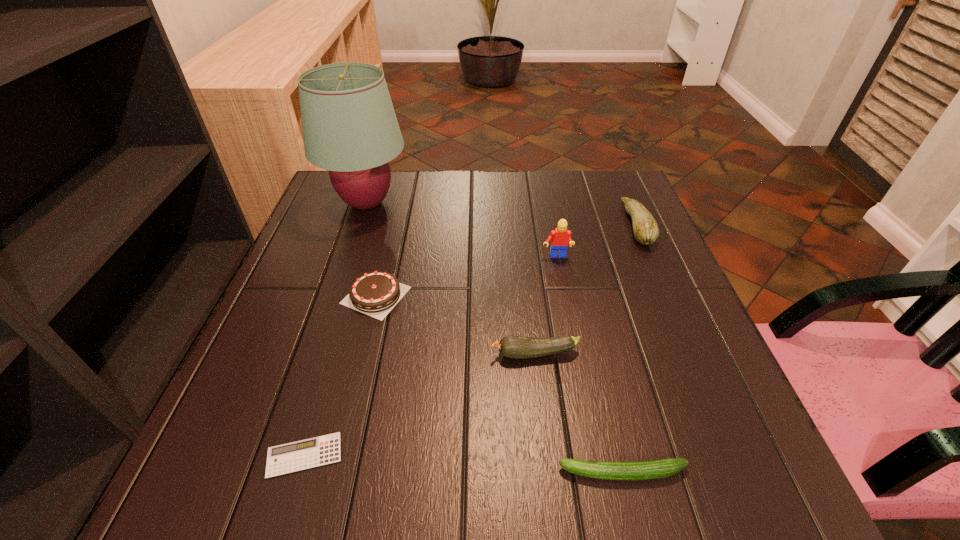
This screenshot has height=540, width=960. Find the location of `the shortest zucchini`. the shortest zucchini is located at coordinates (642, 470).

The width and height of the screenshot is (960, 540). Identify the location of the shortest object. (300, 455).

Find the location of `vacant point located 0.120m on the front of the lampshade`. vacant point located 0.120m on the front of the lampshade is located at coordinates (348, 260).

At what (x,y) coordinates should I click in order to perform the action: click on free space located on the front-facing side of the third farthest object. Please return your answer as a coordinate pair (x, y). This screenshot has width=960, height=540. Looking at the image, I should click on (565, 305).

Locate an element on the screen. vacant space located 0.300m at the stem end of the farthest zucchini is located at coordinates (510, 225).

Identify the location of free region located at the stem end of the farthest zucchini. The image size is (960, 540). (560, 225).

Find the location of a particular element. free space located at the stem end of the farthest zucchini is located at coordinates (590, 225).

This screenshot has width=960, height=540. I want to click on free space located at the blossom end of the second farthest zucchini, so click(x=428, y=354).

The height and width of the screenshot is (540, 960). Identify the location of free space located 0.280m at the blossom end of the second farthest zucchini. (345, 354).

This screenshot has height=540, width=960. What are the coordinates of `free region located 0.260m at the blossom end of the second farthest zucchini` in the screenshot? It's located at (355, 354).